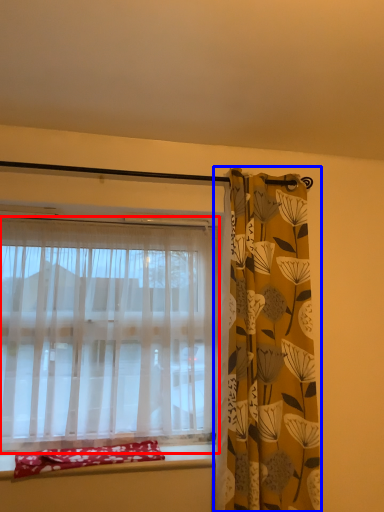
Question: Which of the following is the farthest to the observer, curtain (highlighted by a red box) or curtain (highlighted by a blue box)?

Choices:
 (A) curtain
 (B) curtain

Answer: (A)